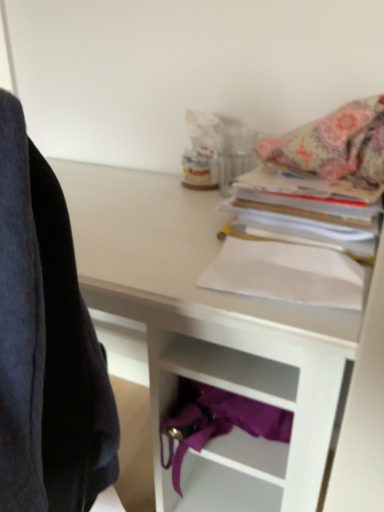
Where is `white matte desk at upper center`? white matte desk at upper center is located at coordinates (231, 344).

Where is `patterned fabric blanket at upper right`? This screenshot has height=512, width=384. patterned fabric blanket at upper right is located at coordinates (335, 145).

Do you think white matte desk at upper center is within patterned fabric blanket at upper right, or outside of it?

white matte desk at upper center is not enclosed by patterned fabric blanket at upper right.

What's the angular difference between white matte desk at upper center and patterned fabric blanket at upper right's facing directions?

3.73 degrees separate the facing orientations of white matte desk at upper center and patterned fabric blanket at upper right.

This screenshot has width=384, height=512. Identify the location of blanket located on the right of white matte desk at upper center. (335, 145).

You are a GUI agent. You are given a task and a screenshot of the screen. Output one action in this format:
    pyautogui.click(x=<x>, y=<y>)
    Task: Click on the blanket behind the white paper at upper right, the second paperback book ordered from the bottom
    
    Given the screenshot: What is the action you would take?
    pyautogui.click(x=335, y=145)

Considering the positions of objects patterned fabric blanket at upper right and white paper at upper right, the second paperback book ordered from the bottom, in the image provided, who is more to the left, patterned fabric blanket at upper right or white paper at upper right, the second paperback book ordered from the bottom,?

white paper at upper right, the second paperback book ordered from the bottom, is more to the left.

Considering the sizes of objects patterned fabric blanket at upper right and white paper at upper right, which is counted as the first paperback book, starting from the top, in the image provided, who is smaller, patterned fabric blanket at upper right or white paper at upper right, which is counted as the first paperback book, starting from the top,?

Smaller between the two is patterned fabric blanket at upper right.

Can you confirm if patterned fabric blanket at upper right is taller than white paper at upper right, the second paperback book ordered from the bottom?

Indeed, patterned fabric blanket at upper right has a greater height compared to white paper at upper right, the second paperback book ordered from the bottom.

What's the angular difference between white paper at upper right, the second paperback book ordered from the bottom, and patterned fabric blanket at upper right's facing directions?

The angle between the facing direction of white paper at upper right, the second paperback book ordered from the bottom, and the facing direction of patterned fabric blanket at upper right is 0.473 degrees.

From the picture: Is white paper at upper right, the second paperback book ordered from the bottom, oriented away from patterned fabric blanket at upper right?

No, white paper at upper right, the second paperback book ordered from the bottom,'s orientation is not away from patterned fabric blanket at upper right.

Is white paper at upper right, which is counted as the first paperback book, starting from the top, outside of patterned fabric blanket at upper right?

Yes.

Considering the relative sizes of patterned fabric blanket at upper right and white matte desk at upper center in the image provided, is patterned fabric blanket at upper right bigger than white matte desk at upper center?

No, patterned fabric blanket at upper right is not bigger than white matte desk at upper center.

Consider the image. Is patterned fabric blanket at upper right looking in the opposite direction of white matte desk at upper center?

No, patterned fabric blanket at upper right is not facing the opposite direction of white matte desk at upper center.

Is patterned fabric blanket at upper right inside or outside of white matte desk at upper center?

patterned fabric blanket at upper right is located beyond the bounds of white matte desk at upper center.

From the image's perspective, which is above, patterned fabric blanket at upper right or white matte desk at upper center?

From the image's view, patterned fabric blanket at upper right is above.

Considering the positions of objects patterned fabric blanket at upper right and white paper at center, placed as the 1th paperback book when sorted from bottom to top, in the image provided, who is more to the left, patterned fabric blanket at upper right or white paper at center, placed as the 1th paperback book when sorted from bottom to top,?

Positioned to the left is white paper at center, placed as the 1th paperback book when sorted from bottom to top.

Considering the relative sizes of patterned fabric blanket at upper right and white paper at center, placed as the 1th paperback book when sorted from bottom to top, in the image provided, is patterned fabric blanket at upper right thinner than white paper at center, placed as the 1th paperback book when sorted from bottom to top,?

No.

Does patterned fabric blanket at upper right come behind white paper at center, positioned as the 2th paperback book in top-to-bottom order?

Yes, patterned fabric blanket at upper right is behind white paper at center, positioned as the 2th paperback book in top-to-bottom order.

Which of these two, patterned fabric blanket at upper right or white paper at center, placed as the 1th paperback book when sorted from bottom to top, is smaller?

Smaller between the two is white paper at center, placed as the 1th paperback book when sorted from bottom to top.

Does white matte desk at upper center have a greater height compared to white paper at center, placed as the 1th paperback book when sorted from bottom to top?

Yes, white matte desk at upper center is taller than white paper at center, placed as the 1th paperback book when sorted from bottom to top.

Can you confirm if white matte desk at upper center is smaller than white paper at center, positioned as the 2th paperback book in top-to-bottom order?

No.

Is point (156, 274) positioned before point (356, 272)?

No.

In order to click on the 2nd paperback book behind the white matte desk at upper center, starting your count from the anchor in this screenshot , I will do `click(303, 217)`.

Considering the positions of points (282, 385) and (326, 227), is point (282, 385) closer to camera compared to point (326, 227)?

Yes, it is in front of point (326, 227).

Could you tell me if white matte desk at upper center is facing white paper at upper right, the second paperback book ordered from the bottom?

No.

Is white matte desk at upper center located outside white paper at upper right, which is counted as the first paperback book, starting from the top?

Yes, white matte desk at upper center is located beyond the bounds of white paper at upper right, which is counted as the first paperback book, starting from the top.

This screenshot has width=384, height=512. Identify the location of desk that is below the patterned fabric blanket at upper right (from the image's perspective). (231, 344).

Locate an element on the screen. blanket above the white paper at upper right, which is counted as the first paperback book, starting from the top (from the image's perspective) is located at coordinates (335, 145).

Based on their spatial positions, is white paper at center, positioned as the 2th paperback book in top-to-bottom order, or white matte desk at upper center closer to patterned fabric blanket at upper right?

Among the two, white paper at center, positioned as the 2th paperback book in top-to-bottom order, is located nearer to patterned fabric blanket at upper right.

From the image, which object appears to be nearer to white paper at center, placed as the 1th paperback book when sorted from bottom to top, patterned fabric blanket at upper right or white paper at upper right, the second paperback book ordered from the bottom?

white paper at upper right, the second paperback book ordered from the bottom, is positioned closer to the anchor white paper at center, placed as the 1th paperback book when sorted from bottom to top.

From the picture: Considering their positions, is white matte desk at upper center positioned further to patterned fabric blanket at upper right than white paper at upper right, the second paperback book ordered from the bottom?

white matte desk at upper center is positioned further to the anchor patterned fabric blanket at upper right.

From the image, which object appears to be nearer to white paper at upper right, which is counted as the first paperback book, starting from the top, patterned fabric blanket at upper right or white paper at center, placed as the 1th paperback book when sorted from bottom to top?

white paper at center, placed as the 1th paperback book when sorted from bottom to top, lies closer to white paper at upper right, which is counted as the first paperback book, starting from the top, than the other object.

From the image, which object appears to be farther from patterned fabric blanket at upper right, white paper at upper right, which is counted as the first paperback book, starting from the top, or white matte desk at upper center?

white matte desk at upper center.

Based on their spatial positions, is patterned fabric blanket at upper right or white matte desk at upper center closer to white paper at center, positioned as the 2th paperback book in top-to-bottom order?

white matte desk at upper center is positioned closer to the anchor white paper at center, positioned as the 2th paperback book in top-to-bottom order.

Based on the photo, estimate the real-world distances between objects in this image. Which object is closer to white paper at upper right, the second paperback book ordered from the bottom, white matte desk at upper center or patterned fabric blanket at upper right?

patterned fabric blanket at upper right lies closer to white paper at upper right, the second paperback book ordered from the bottom, than the other object.

Which object lies further to the anchor point white paper at upper right, the second paperback book ordered from the bottom, patterned fabric blanket at upper right or white matte desk at upper center?

white matte desk at upper center lies further to white paper at upper right, the second paperback book ordered from the bottom, than the other object.

Where is `paperback book that lies between patterned fabric blanket at upper right and white paper at center, placed as the 1th paperback book when sorted from bottom to top, from top to bottom`? The width and height of the screenshot is (384, 512). paperback book that lies between patterned fabric blanket at upper right and white paper at center, placed as the 1th paperback book when sorted from bottom to top, from top to bottom is located at coordinates (303, 217).

Where is `paperback book between white paper at upper right, which is counted as the first paperback book, starting from the top, and white matte desk at upper center in the up-down direction`? paperback book between white paper at upper right, which is counted as the first paperback book, starting from the top, and white matte desk at upper center in the up-down direction is located at coordinates (286, 274).